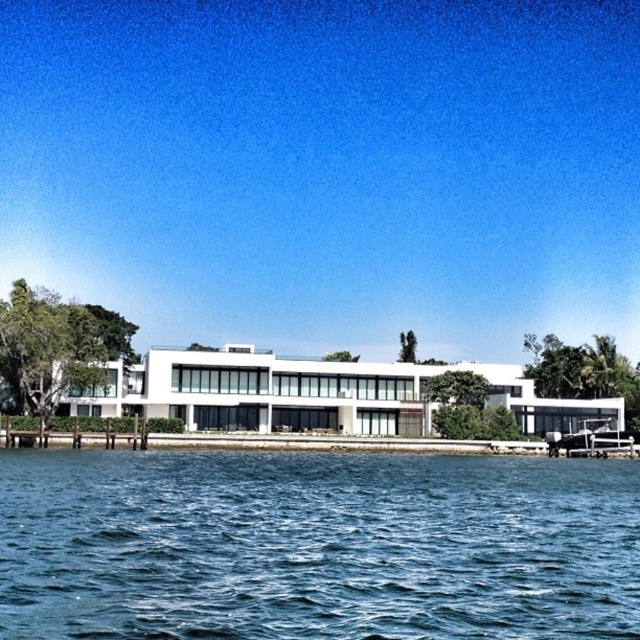
You are a guest at the waterfront property and want to walk from the house to the metallic silver boat at right. Which direction should you head towards from the blue water at lower center?

You should head towards the right direction from the blue water at lower center to reach the metallic silver boat at right since the blue water at lower center is to the left of metallic silver boat at right.

You are standing on the dock and want to get to the metallic silver boat at right. According to the scene, is the blue water at lower center between you and the boat?

Yes, the blue water at lower center is above the metallic silver boat at right, meaning it is between you and the boat when standing on the dock.